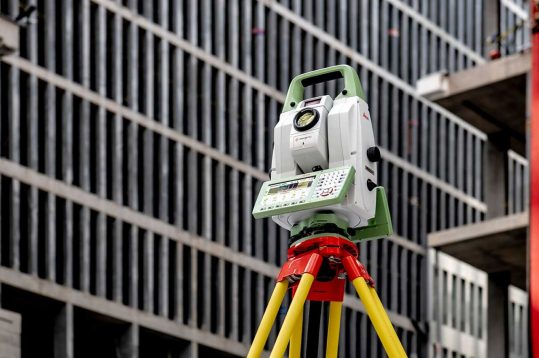
Image resolution: width=539 pixels, height=358 pixels. What are the coordinates of `knob` in the screenshot? It's located at (374, 153).